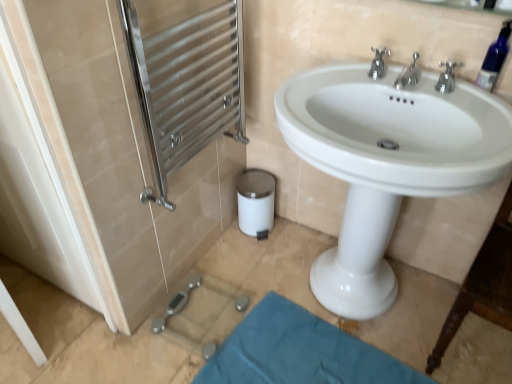
Locate an element on the screen. This screenshot has width=512, height=384. free space that is in between polished chrome faucet at upper center, which appears as the 2th tap when viewed from the right, and silver metallic faucet at upper right, the 1th tap from the right is located at coordinates (424, 94).